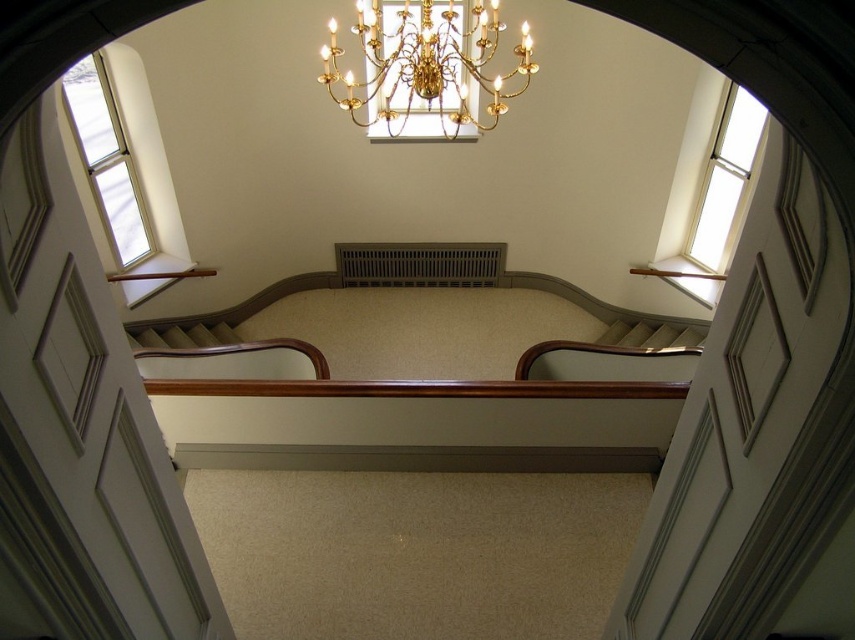
Question: Is white glass window at upper left above clear glass window at upper right?

Choices:
 (A) no
 (B) yes

Answer: (B)

Question: Which of the following is the farthest from the observer?

Choices:
 (A) (363, 36)
 (B) (108, 170)
 (C) (428, 243)
 (D) (743, 170)

Answer: (C)

Question: Which is nearer to the wooden balustrade at center?

Choices:
 (A) gold metallic chandelier at upper center
 (B) white glass window at upper left
 (C) clear glass window at upper right

Answer: (A)

Question: From the image, what is the correct spatial relationship of gold metallic chandelier at upper center in relation to white glass window at upper left?

Choices:
 (A) above
 (B) below

Answer: (A)

Question: Which of the following is the farthest from the observer?

Choices:
 (A) gold metallic chandelier at upper center
 (B) wooden balustrade at center

Answer: (B)

Question: Does gold metallic chandelier at upper center have a larger size compared to clear glass window at upper right?

Choices:
 (A) yes
 (B) no

Answer: (A)